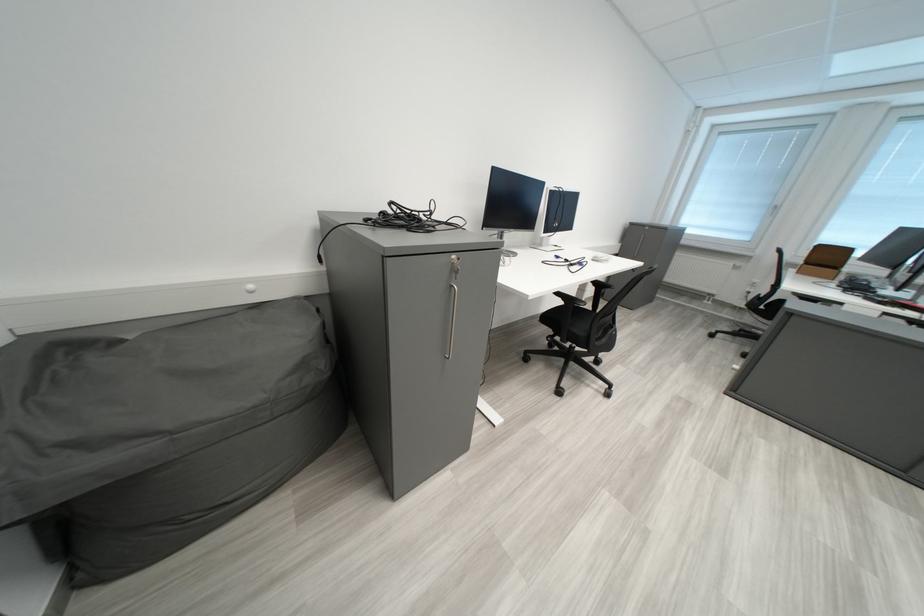
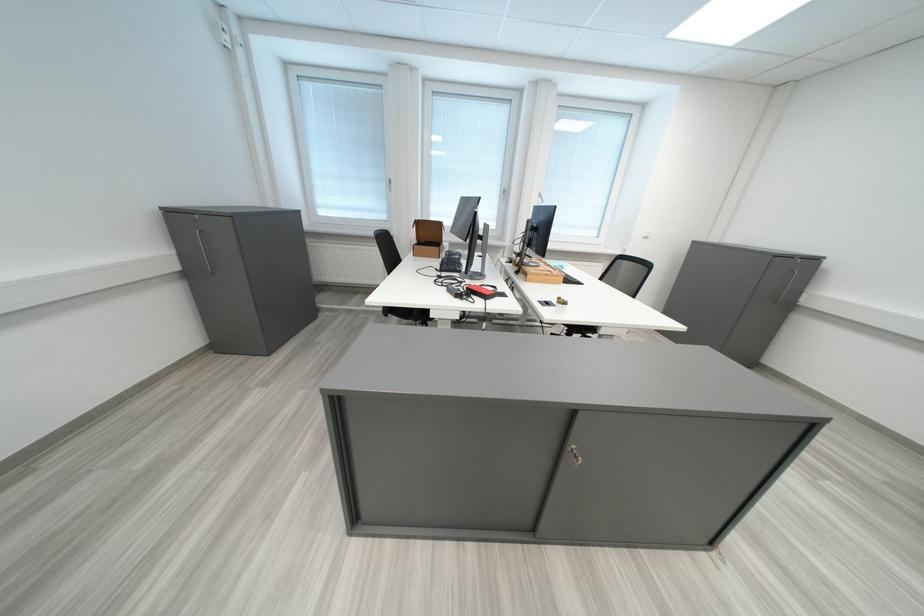
Find the pixel in the second image that matches the point at 855,280 in the first image.

(456, 256)